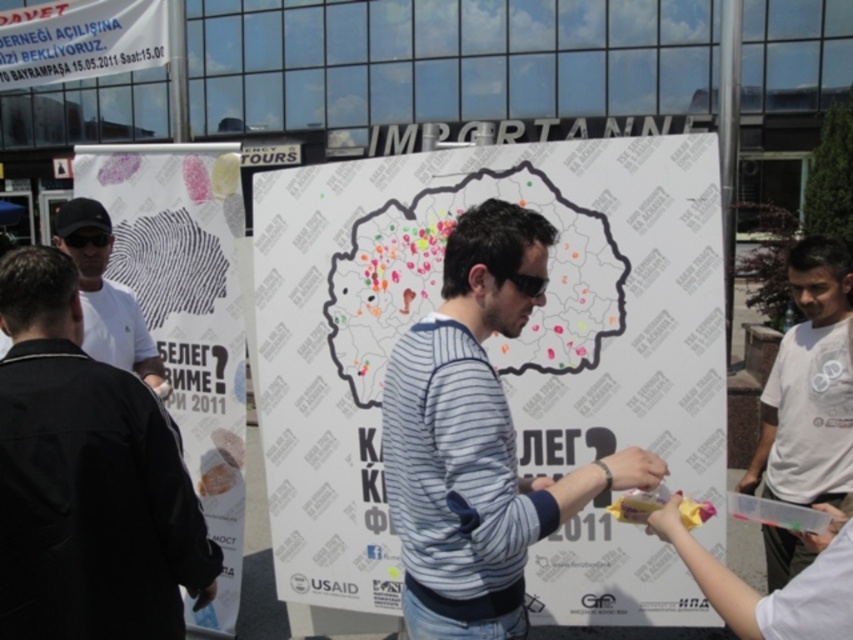
You are standing in front of the informational display board and want to locate two points marked on the map. The first point is at coordinates point (287, 582) and the second is at point (216, 461). Which point is closer to you when looking at the board?

Point (287, 582) is in front of point (216, 461), so it is closer to you when looking at the board.